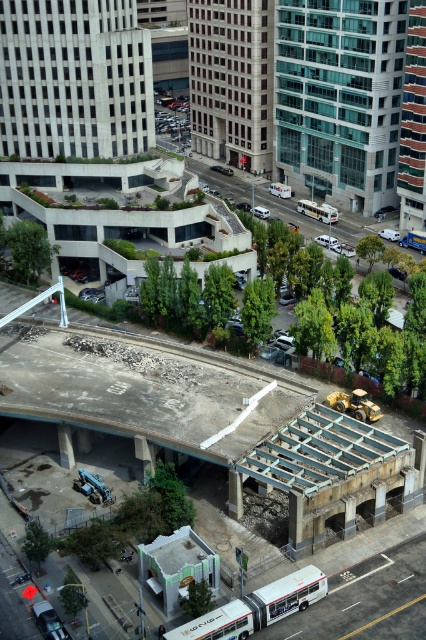
Who is positioned more to the right, white matte bus at center or matte silver sedan at center?

white matte bus at center

Can you confirm if white matte bus at center is taller than matte silver sedan at center?

Yes.

Locate an element on the screen. white matte bus at center is located at coordinates (317, 211).

Can you confirm if blue metallic bus at center is taller than matte silver sedan at center?

Indeed, blue metallic bus at center has a greater height compared to matte silver sedan at center.

Who is shorter, blue metallic bus at center or matte silver sedan at center?

With less height is matte silver sedan at center.

I want to click on blue metallic bus at center, so click(x=414, y=241).

The height and width of the screenshot is (640, 426). Find the location of `blue metallic bus at center`. blue metallic bus at center is located at coordinates (414, 241).

Can you confirm if white matte bus at lower center is positioned above white matte bus at center?

No, white matte bus at lower center is not above white matte bus at center.

The height and width of the screenshot is (640, 426). Identify the location of white matte bus at lower center. tap(256, 608).

Is point (287, 596) positioned before point (327, 209)?

Yes.

The image size is (426, 640). I want to click on white matte bus at lower center, so click(256, 608).